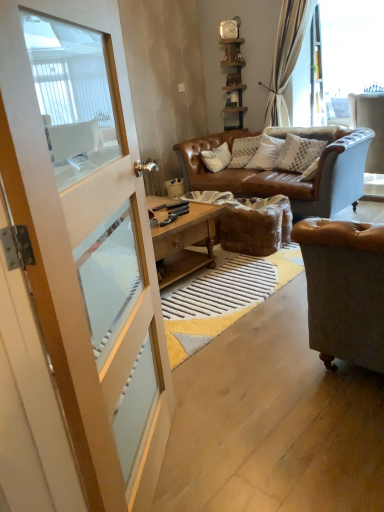
Where is `vacant space in front of brown leather footrest at center`? The width and height of the screenshot is (384, 512). vacant space in front of brown leather footrest at center is located at coordinates (255, 267).